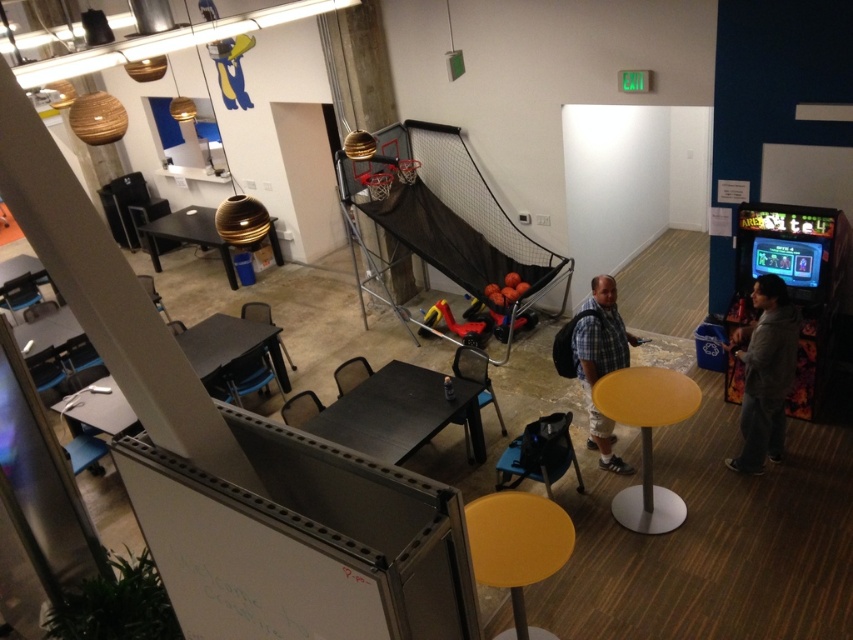
You are a GUI agent. You are given a task and a screenshot of the screen. Output one action in this format:
    pyautogui.click(x=<x>, y=<y>)
    Task: Click on the yellow matte table at center
    The image size is (853, 640).
    Given the screenshot: What is the action you would take?
    pyautogui.click(x=646, y=438)

Does yellow matte table at center have a smaller size compared to wooden table at center?

Indeed, yellow matte table at center has a smaller size compared to wooden table at center.

Is point (625, 502) positioned before point (190, 237)?

Yes, point (625, 502) is closer to viewer.

Locate an element on the screen. yellow matte table at center is located at coordinates (646, 438).

In the scene shown: Who is more forward, (368, 435) or (202, 214)?

Point (368, 435) is in front.

Find the location of a particular element. Image resolution: width=853 pixels, height=640 pixels. black matte table at center is located at coordinates (399, 413).

Which is above, plaid shirt at center or wooden table at center?

wooden table at center is higher up.

Does plaid shirt at center have a greater width compared to wooden table at center?

Answer: No.

Who is more forward, (595, 316) or (184, 237)?

Point (595, 316) is more forward.

Where is `plaid shirt at center`? This screenshot has width=853, height=640. plaid shirt at center is located at coordinates click(601, 362).